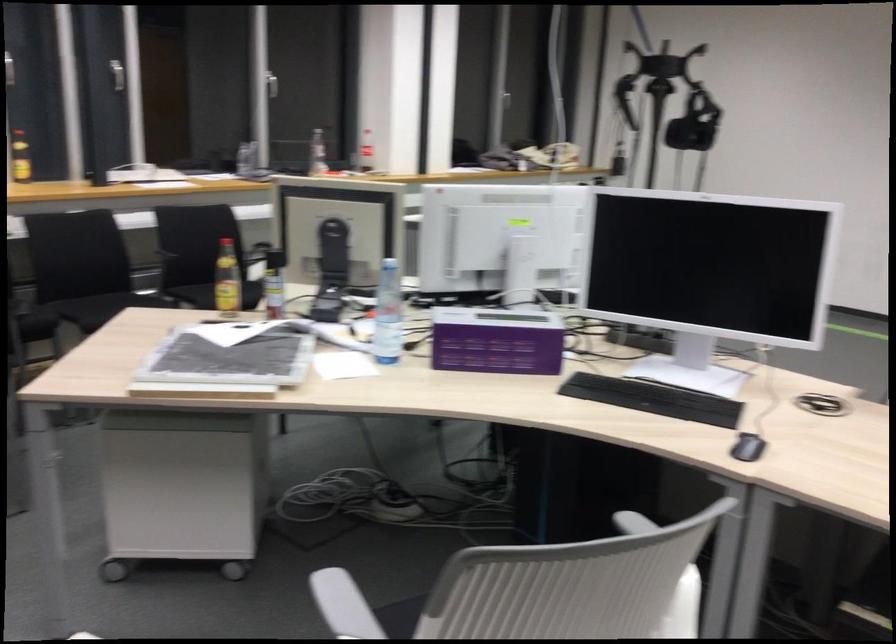
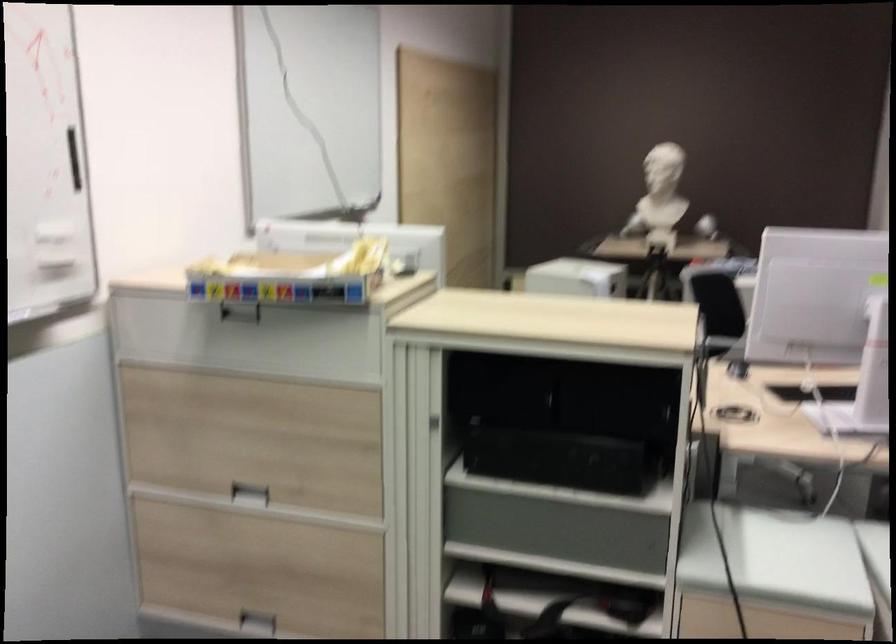
Question: I am providing you with two images of the same scene from different viewpoints. Which of the following objects are not visible in image2?

Choices:
 (A) recessed drawer handle
 (B) black box handle
 (C) light dimmer knob
 (D) chair sitting surface

Answer: (D)